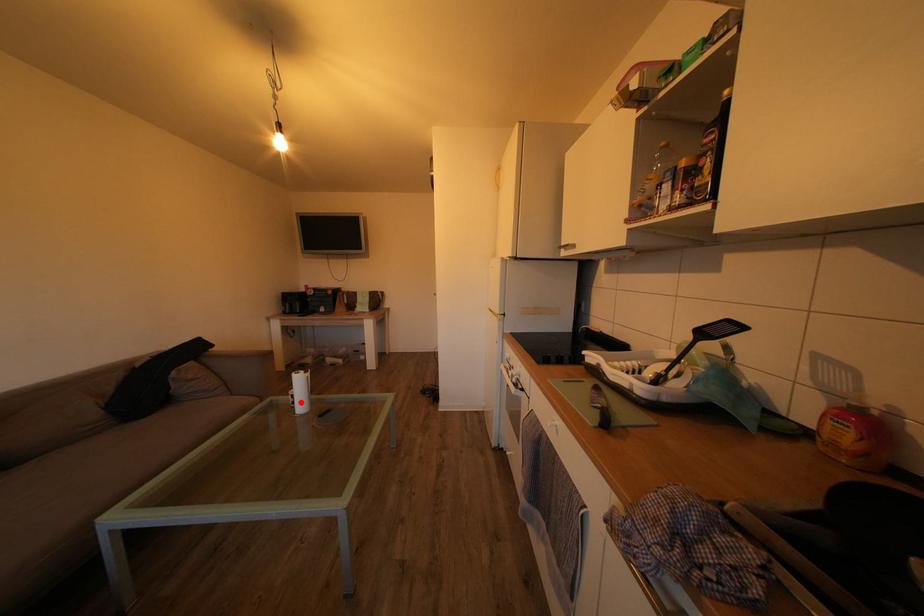
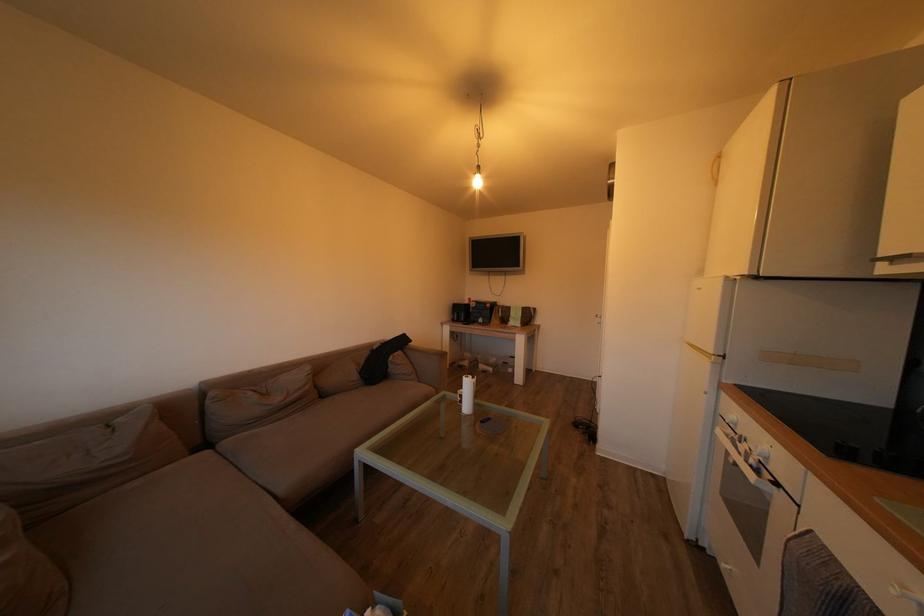
Question: I am providing you with two images of the same scene from different viewpoints. A red point is marked on the first image. Can you still see the location of the red point in image 2?

Choices:
 (A) Yes
 (B) No

Answer: (A)